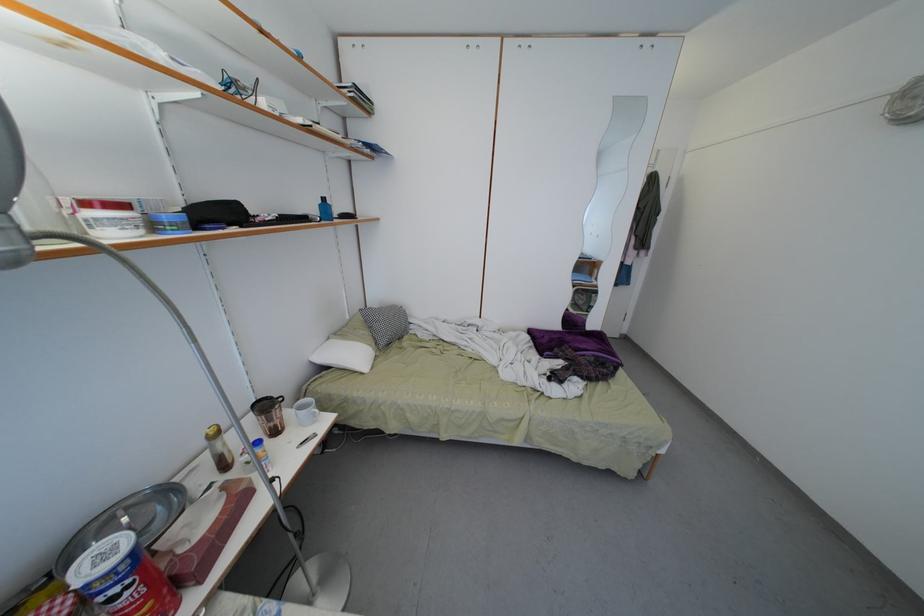
Find where to lift the yellow-lidded jar. Please return your answer as a coordinate pair (x, y).

(219, 448)